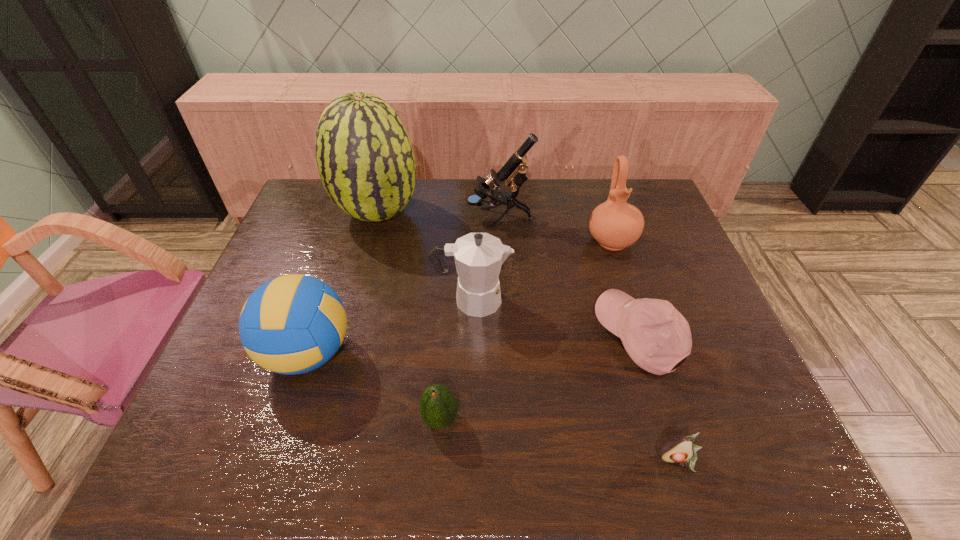
Identify the location of vacant space situated 0.260m on the right of the watermelon. The image size is (960, 540). (500, 214).

You are a GUI agent. You are given a task and a screenshot of the screen. Output one action in this format:
    pyautogui.click(x=<x>, y=<y>)
    Task: Click on the vacant region located 0.380m through the eyepiece of the microscope
    Image resolution: width=960 pixels, height=540 pixels.
    Given the screenshot: What is the action you would take?
    (349, 218)

You are a GUI agent. You are given a task and a screenshot of the screen. Output one action in this format:
    pyautogui.click(x=<x>, y=<y>)
    Task: Click on the blank space located through the eyepiece of the microscope
    The width and height of the screenshot is (960, 540).
    Given the screenshot: What is the action you would take?
    pyautogui.click(x=426, y=218)

Image resolution: width=960 pixels, height=540 pixels. Find the location of `blank area located through the eyepiece of the microscope`. blank area located through the eyepiece of the microscope is located at coordinates (418, 218).

Locate an element on the screen. This screenshot has height=540, width=960. vacant point located on the spout of the pottery is located at coordinates (628, 291).

I want to click on vacant area located at the spout of the coffeepot, so click(635, 300).

You are a GUI agent. You are given a task and a screenshot of the screen. Output one action in this format:
    pyautogui.click(x=<x>, y=<y>)
    Task: Click on the free space located on the front of the volleyball
    The image size is (960, 540).
    Given the screenshot: What is the action you would take?
    pyautogui.click(x=278, y=443)

At what (x,y) coordinates should I click in order to perform the action: click on blank space located on the front-facing side of the baseball cap. Please return your answer as a coordinate pair (x, y). The width and height of the screenshot is (960, 540). Looking at the image, I should click on (544, 337).

Locate an element on the screen. This screenshot has height=540, width=960. vacant space located 0.220m on the front-facing side of the baseball cap is located at coordinates (507, 337).

Locate an element on the screen. The image size is (960, 540). free space located on the front-facing side of the baseball cap is located at coordinates (507, 337).